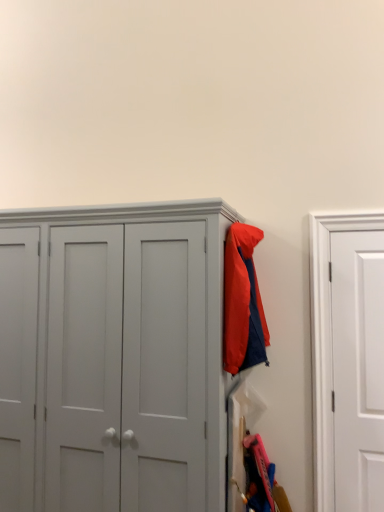
Question: From a real-world perspective, is matte gray cupboard at center below matte nylon jacket at upper right?

Choices:
 (A) no
 (B) yes

Answer: (B)

Question: Could you tell me if matte gray cupboard at center is facing matte nylon jacket at upper right?

Choices:
 (A) yes
 (B) no

Answer: (B)

Question: Is matte gray cupboard at center positioned far away from matte nylon jacket at upper right?

Choices:
 (A) yes
 (B) no

Answer: (B)

Question: Can you confirm if matte gray cupboard at center is shorter than matte nylon jacket at upper right?

Choices:
 (A) yes
 (B) no

Answer: (B)

Question: Is matte gray cupboard at center facing away from matte nylon jacket at upper right?

Choices:
 (A) no
 (B) yes

Answer: (A)

Question: Is matte gray cupboard at center smaller than matte nylon jacket at upper right?

Choices:
 (A) yes
 (B) no

Answer: (B)

Question: Is matte gray cupboard at center not near white matte door at right?

Choices:
 (A) no
 (B) yes

Answer: (B)

Question: From the image's perspective, is matte gray cupboard at center on white matte door at right?

Choices:
 (A) no
 (B) yes

Answer: (A)

Question: Considering the relative sizes of matte gray cupboard at center and white matte door at right in the image provided, is matte gray cupboard at center shorter than white matte door at right?

Choices:
 (A) no
 (B) yes

Answer: (A)

Question: Does matte gray cupboard at center have a greater width compared to white matte door at right?

Choices:
 (A) yes
 (B) no

Answer: (A)

Question: Is white matte door at right a part of matte gray cupboard at center?

Choices:
 (A) yes
 (B) no

Answer: (B)

Question: From a real-world perspective, is matte gray cupboard at center below white matte door at right?

Choices:
 (A) no
 (B) yes

Answer: (B)

Question: Considering the relative positions of matte nylon jacket at upper right and white matte door at right in the image provided, is matte nylon jacket at upper right behind white matte door at right?

Choices:
 (A) no
 (B) yes

Answer: (A)